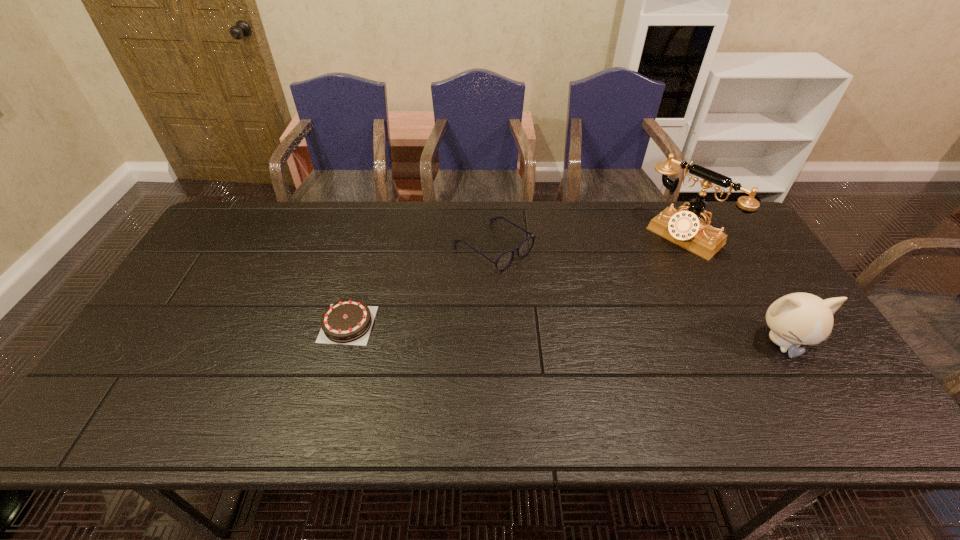
The image size is (960, 540). I want to click on the shortest object, so point(349,322).

Where is `chocolate cake`? The height and width of the screenshot is (540, 960). chocolate cake is located at coordinates (x=349, y=322).

Locate an element on the screen. the second tallest object is located at coordinates (796, 319).

I want to click on the third object from right to left, so click(505, 259).

Where is `spectacles`? The height and width of the screenshot is (540, 960). spectacles is located at coordinates (505, 259).

This screenshot has width=960, height=540. What are the coordinates of `the tallest object` in the screenshot? It's located at tap(687, 229).

Find the location of a particular element. vacant space located on the left of the shortest object is located at coordinates (181, 324).

Locate an element on the screen. The image size is (960, 540). vacant space located on the face of the third shortest object is located at coordinates (805, 381).

Identify the location of free space located on the front-facing side of the third tallest object. The height and width of the screenshot is (540, 960). (586, 311).

This screenshot has height=540, width=960. Find the location of `vacant space located 0.250m on the front-facing side of the third tallest object`. vacant space located 0.250m on the front-facing side of the third tallest object is located at coordinates (591, 315).